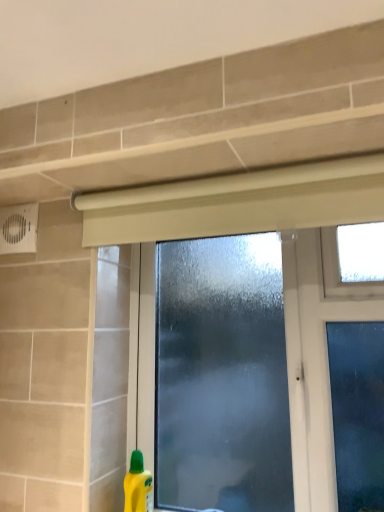
The height and width of the screenshot is (512, 384). What do you see at coordinates (239, 203) in the screenshot? I see `frosted glass window at center` at bounding box center [239, 203].

Find the location of `frosted glass window at center`. frosted glass window at center is located at coordinates (239, 203).

Describe the element at coordinates (138, 486) in the screenshot. The image size is (384, 512). I see `yellow plastic bottle at lower left` at that location.

At what (x,y) coordinates should I click in order to perform the action: click on yellow plastic bottle at lower left. Please return your answer as a coordinate pair (x, y). Looking at the image, I should click on (138, 486).

Image resolution: width=384 pixels, height=512 pixels. In order to click on frosted glass window at center in this screenshot , I will do `click(239, 203)`.

Considering the relative positions of yellow plastic bottle at lower left and frosted glass window at center in the image provided, is yellow plastic bottle at lower left to the left of frosted glass window at center from the viewer's perspective?

Yes.

Considering their positions, is yellow plastic bottle at lower left located in front of or behind frosted glass window at center?

In the image, yellow plastic bottle at lower left appears behind frosted glass window at center.

Which is closer, [135,501] or [331,195]?

The point [331,195] is more forward.

Based on the photo, from the image's perspective, which is above, yellow plastic bottle at lower left or frosted glass window at center?

frosted glass window at center.

From a real-world perspective, is yellow plastic bottle at lower left above or below frosted glass window at center?

yellow plastic bottle at lower left is below frosted glass window at center.

Considering the sizes of objects yellow plastic bottle at lower left and frosted glass window at center in the image provided, who is thinner, yellow plastic bottle at lower left or frosted glass window at center?

With smaller width is frosted glass window at center.

Is yellow plastic bottle at lower left taller than frosted glass window at center?

No.

From the picture: Considering the sizes of yellow plastic bottle at lower left and frosted glass window at center in the image, is yellow plastic bottle at lower left bigger or smaller than frosted glass window at center?

In the image, yellow plastic bottle at lower left appears to be smaller than frosted glass window at center.

Is yellow plastic bottle at lower left not within frosted glass window at center?

That's correct, yellow plastic bottle at lower left is outside of frosted glass window at center.

Is yellow plastic bottle at lower left not near frosted glass window at center?

yellow plastic bottle at lower left is near frosted glass window at center, not far away.

Looking at this image, does yellow plastic bottle at lower left turn towards frosted glass window at center?

No.

How different are the orientations of yellow plastic bottle at lower left and frosted glass window at center in degrees?

The angle between the facing direction of yellow plastic bottle at lower left and the facing direction of frosted glass window at center is 0.439 degrees.

Where is `cleaning product on the left of frosted glass window at center`? The width and height of the screenshot is (384, 512). cleaning product on the left of frosted glass window at center is located at coordinates (138, 486).

Which is more to the right, frosted glass window at center or yellow plastic bottle at lower left?

From the viewer's perspective, frosted glass window at center appears more on the right side.

Is frosted glass window at center closer to the viewer compared to yellow plastic bottle at lower left?

Yes.

Which is behind, point (289, 193) or point (145, 484)?

The point (145, 484) is more distant.

From the image's perspective, is frosted glass window at center located above yellow plastic bottle at lower left?

Yes, from the image's perspective, frosted glass window at center is above yellow plastic bottle at lower left.

From a real-world perspective, is frosted glass window at center on yellow plastic bottle at lower left?

Indeed, from a real-world perspective, frosted glass window at center stands above yellow plastic bottle at lower left.

Between frosted glass window at center and yellow plastic bottle at lower left, which one has larger width?

yellow plastic bottle at lower left is wider.

Between frosted glass window at center and yellow plastic bottle at lower left, which one has less height?

yellow plastic bottle at lower left.

Does frosted glass window at center have a larger size compared to yellow plastic bottle at lower left?

Yes, frosted glass window at center is bigger than yellow plastic bottle at lower left.

Is yellow plastic bottle at lower left inside frosted glass window at center?

No, yellow plastic bottle at lower left is located outside of frosted glass window at center.

Is frosted glass window at center not near yellow plastic bottle at lower left?

frosted glass window at center is actually quite close to yellow plastic bottle at lower left.

Does frosted glass window at center turn towards yellow plastic bottle at lower left?

Yes, frosted glass window at center is oriented towards yellow plastic bottle at lower left.

How far apart are frosted glass window at center and yellow plastic bottle at lower left?

frosted glass window at center is 30.69 inches from yellow plastic bottle at lower left.

Find the location of a particular element. This screenshot has height=512, width=384. cleaning product that appears on the left of frosted glass window at center is located at coordinates (138, 486).

Identify the location of window lying on the right of yellow plastic bottle at lower left. pos(239,203).

Identify the location of cleaning product behind the frosted glass window at center. (138, 486).